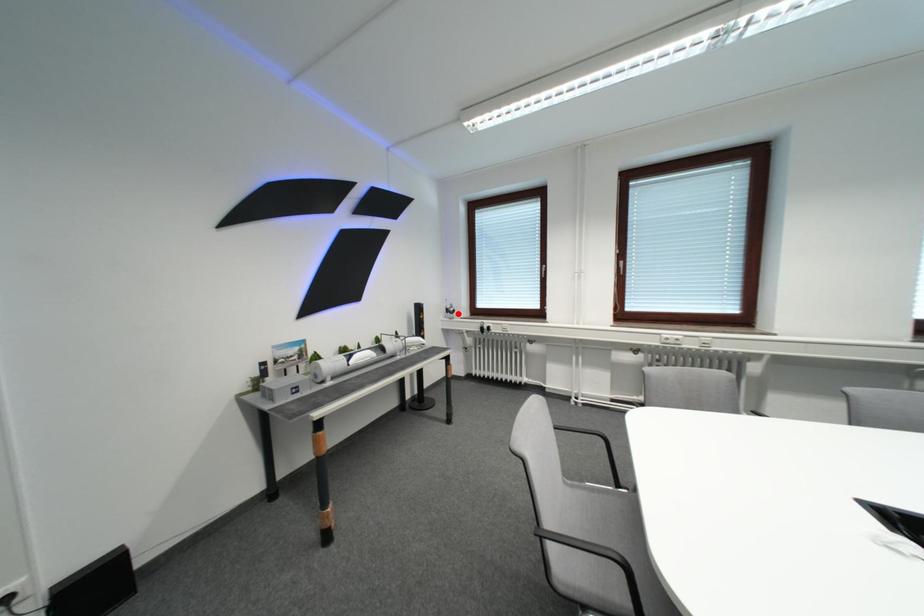
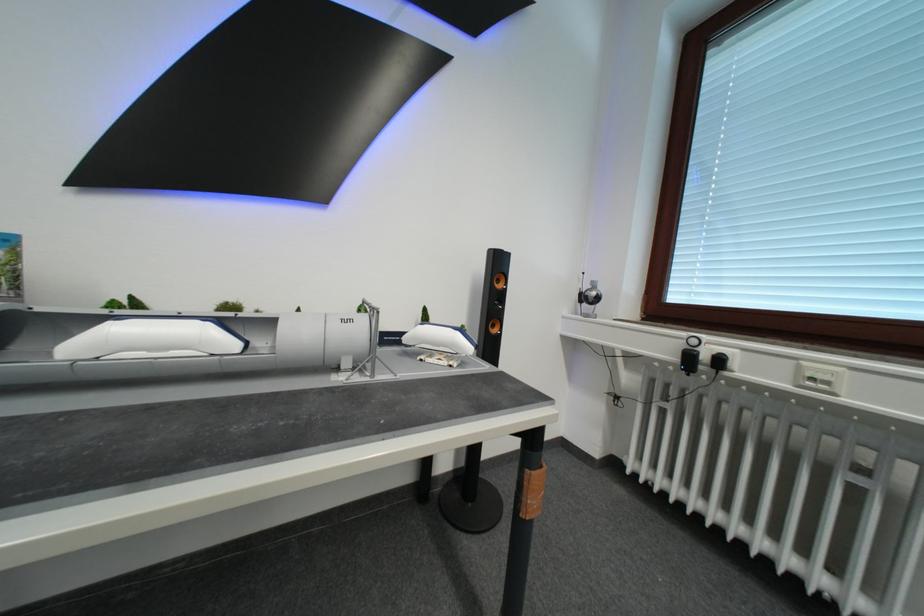
Where in the second image is the point corresponding to the highlighted location from the first image?

(592, 301)